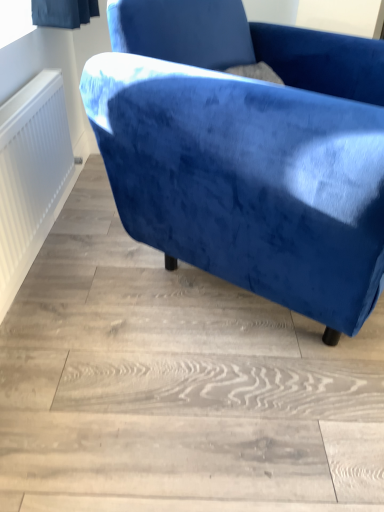
You are a GUI agent. You are given a task and a screenshot of the screen. Output one action in this format:
    pyautogui.click(x=<x>, y=<y>)
    Task: Click on the white textured radiator at left
    This screenshot has height=512, width=384.
    Given the screenshot: What is the action you would take?
    coord(31,175)

The image size is (384, 512). What do you see at coordinates (31, 175) in the screenshot?
I see `white textured radiator at left` at bounding box center [31, 175].

The height and width of the screenshot is (512, 384). What do you see at coordinates (247, 151) in the screenshot?
I see `velvet blue armchair at upper right` at bounding box center [247, 151].

Locate an element on the screen. This screenshot has height=512, width=384. velvet blue armchair at upper right is located at coordinates (247, 151).

What is the approximate width of velvet blue armchair at upper right?

velvet blue armchair at upper right is 34.51 inches wide.

This screenshot has height=512, width=384. What are the coordinates of `white textured radiator at left` in the screenshot? It's located at (31, 175).

Considering the positions of objects white textured radiator at left and velvet blue armchair at upper right in the image provided, who is more to the right, white textured radiator at left or velvet blue armchair at upper right?

velvet blue armchair at upper right is more to the right.

Relative to velvet blue armchair at upper right, is white textured radiator at left in front or behind?

white textured radiator at left is behind velvet blue armchair at upper right.

Is point (17, 158) behind point (338, 96)?

No, it is not.

From the image's perspective, between white textured radiator at left and velvet blue armchair at upper right, who is located below?

From the image's view, white textured radiator at left is below.

From the picture: From a real-world perspective, is white textured radiator at left located higher than velvet blue armchair at upper right?

No, from a real-world perspective, white textured radiator at left is not above velvet blue armchair at upper right.

From the picture: Which object is wider, white textured radiator at left or velvet blue armchair at upper right?

Wider between the two is velvet blue armchair at upper right.

From their relative heights in the image, would you say white textured radiator at left is taller or shorter than velvet blue armchair at upper right?

white textured radiator at left is shorter than velvet blue armchair at upper right.

Consider the image. Which of these two, white textured radiator at left or velvet blue armchair at upper right, is bigger?

With larger size is velvet blue armchair at upper right.

Is velvet blue armchair at upper right a part of white textured radiator at left?

Actually, velvet blue armchair at upper right is outside white textured radiator at left.

Based on the photo, is there a large distance between white textured radiator at left and velvet blue armchair at upper right?

No, white textured radiator at left is not far from velvet blue armchair at upper right.

Looking at this image, does white textured radiator at left turn towards velvet blue armchair at upper right?

Yes.

You are a GUI agent. You are given a task and a screenshot of the screen. Output one action in this format:
    pyautogui.click(x=<x>, y=<y>)
    Task: Click on the radiator on the left of velvet blue armchair at upper right
    This screenshot has width=384, height=512.
    Given the screenshot: What is the action you would take?
    pyautogui.click(x=31, y=175)

Does velvet blue armchair at upper right appear on the left side of white textured radiator at left?

No, velvet blue armchair at upper right is not to the left of white textured radiator at left.

Considering the positions of objects velvet blue armchair at upper right and white textured radiator at left in the image provided, who is behind, velvet blue armchair at upper right or white textured radiator at left?

white textured radiator at left.

Is point (357, 59) farther from viewer compared to point (13, 122)?

Yes, point (357, 59) is farther from viewer.

From the image's perspective, is velvet blue armchair at upper right over white textured radiator at left?

Correct, velvet blue armchair at upper right appears higher than white textured radiator at left in the image.

From a real-world perspective, is velvet blue armchair at upper right on white textured radiator at left?

Correct, in the physical world, velvet blue armchair at upper right is higher than white textured radiator at left.

Considering the relative sizes of velvet blue armchair at upper right and white textured radiator at left in the image provided, is velvet blue armchair at upper right thinner than white textured radiator at left?

No, velvet blue armchair at upper right is not thinner than white textured radiator at left.

From the picture: Does velvet blue armchair at upper right have a greater height compared to white textured radiator at left?

Indeed, velvet blue armchair at upper right has a greater height compared to white textured radiator at left.

Considering the sizes of objects velvet blue armchair at upper right and white textured radiator at left in the image provided, who is smaller, velvet blue armchair at upper right or white textured radiator at left?

white textured radiator at left is smaller.

Is velvet blue armchair at upper right not inside white textured radiator at left?

Yes, velvet blue armchair at upper right is outside of white textured radiator at left.

Would you say velvet blue armchair at upper right is a long distance from white textured radiator at left?

No, velvet blue armchair at upper right is in close proximity to white textured radiator at left.

Is velvet blue armchair at upper right facing towards white textured radiator at left?

No, velvet blue armchair at upper right is not turned towards white textured radiator at left.

The width and height of the screenshot is (384, 512). Find the location of `radiator to the left of velvet blue armchair at upper right`. radiator to the left of velvet blue armchair at upper right is located at coordinates (31, 175).

There is a white textured radiator at left. Identify the location of chair above it (from a real-world perspective). The width and height of the screenshot is (384, 512). (247, 151).

Find the location of a particular element. radiator below the velvet blue armchair at upper right (from the image's perspective) is located at coordinates (31, 175).